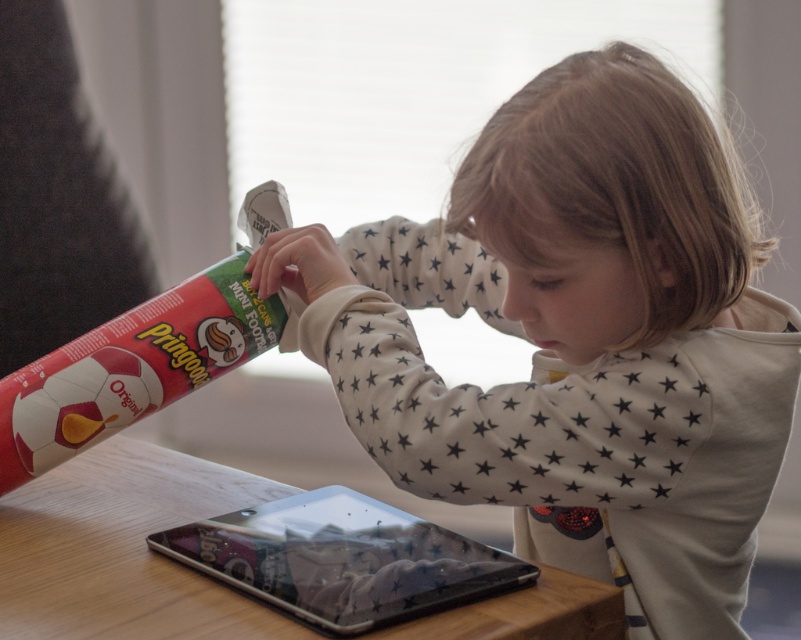
You are a parent trying to ensure your child doesn not spill the Pringles. The child is reaching for the matte red pringles can at left and the transparent plastic tablet at center. Based on their positions, which item is closer to the edge of the table?

The matte red pringles can at left is above transparent plastic tablet at center, meaning it is closer to the edge of the table than the tablet.

You are a parent trying to decide whether to let your child open the matte red pringles can at left or the transparent plastic tablet at center. Considering their sizes, which item is bigger and should you be more cautious about?

The matte red pringles can at left is larger in size compared to the transparent plastic tablet at center, so you should be more cautious about the matte red pringles can at left due to its bigger size.